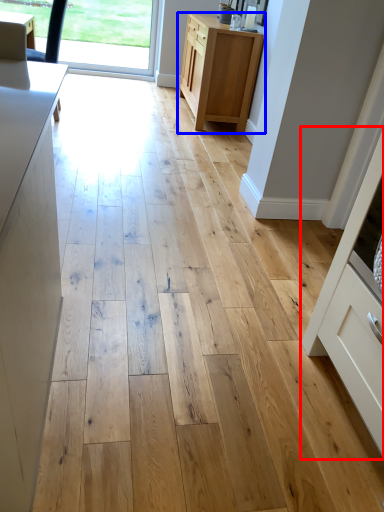
Question: Which object is further to the camera taking this photo, cabinetry (highlighted by a red box) or cabinetry (highlighted by a blue box)?

Choices:
 (A) cabinetry
 (B) cabinetry

Answer: (B)